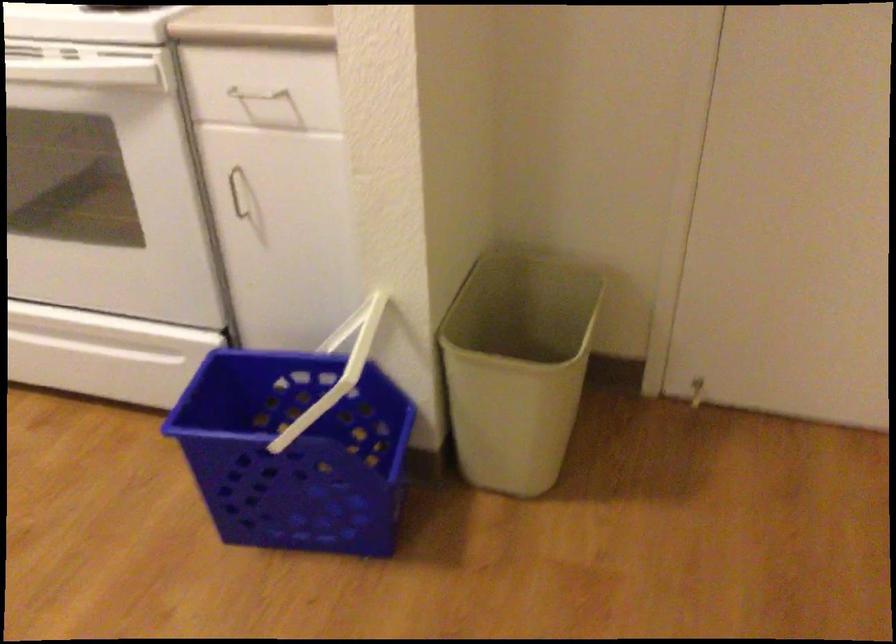
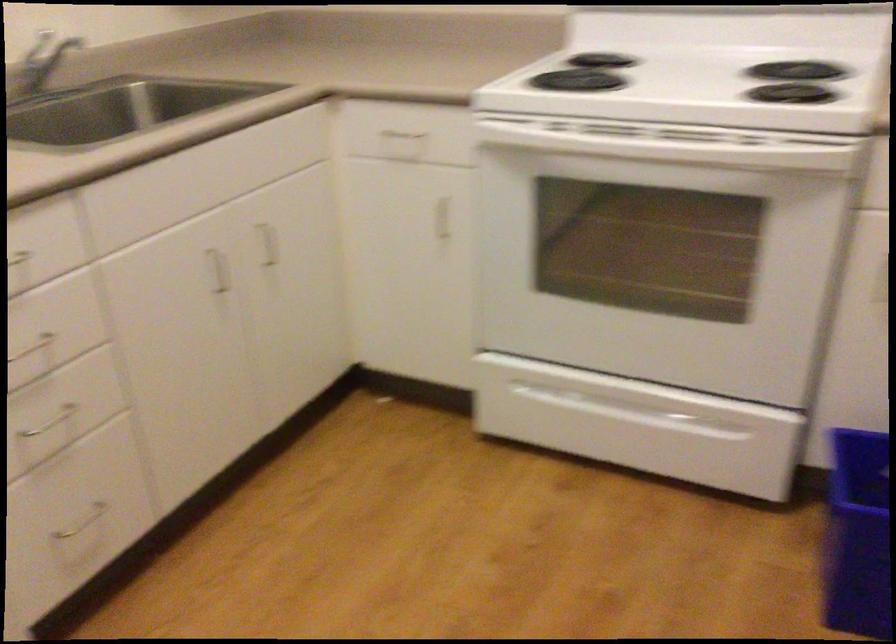
Question: The camera is either moving clockwise (left) or counter-clockwise (right) around the object. The first image is from the beginning of the video and the second image is from the end. Is the camera moving left or right when shooting the video?

Choices:
 (A) Left
 (B) Right

Answer: (B)